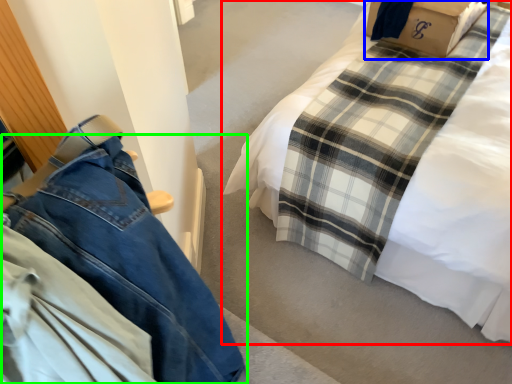
Question: Which is farther away from bed (highlighted by a red box)? cardboard box (highlighted by a blue box) or trousers (highlighted by a green box)?

Choices:
 (A) cardboard box
 (B) trousers

Answer: (B)